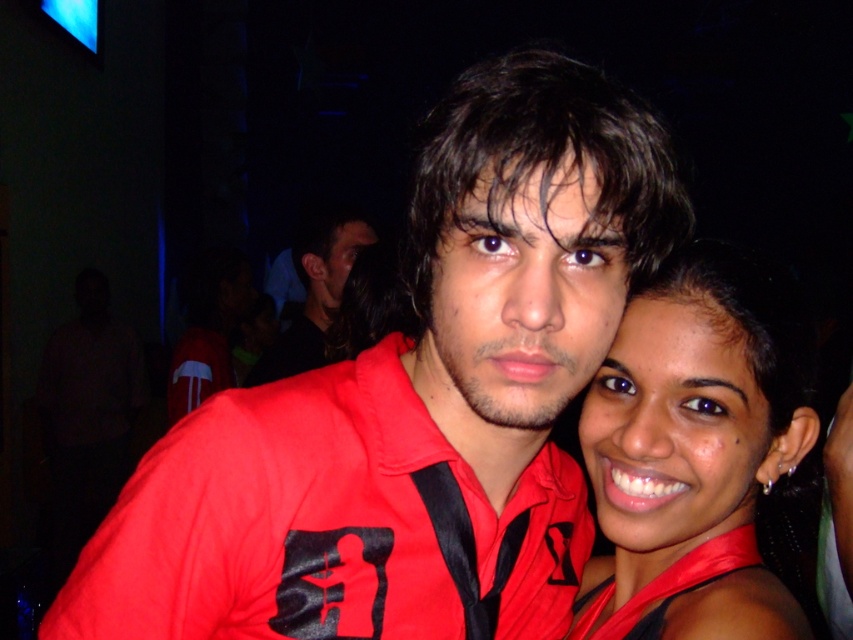
You are planning to take a photo of the matte black shirt at center and the satin red dress at right for a fashion magazine. The editor wants the two items to be visible in the same frame. Based on their positions, can you position the camera so both are in the frame?

The satin red dress at right is located below the matte black shirt at center, so yes, you can position the camera to include both in the frame by angling it to capture the matte black shirt at center above and the satin red dress at right below.

You are at a party and want to take a photo of the matte black shirt at center and the satin red dress at right. Which one is positioned more to the right side of the frame?

The satin red dress at right is positioned to the right of the matte black shirt at center, so it is more to the right side of the frame.